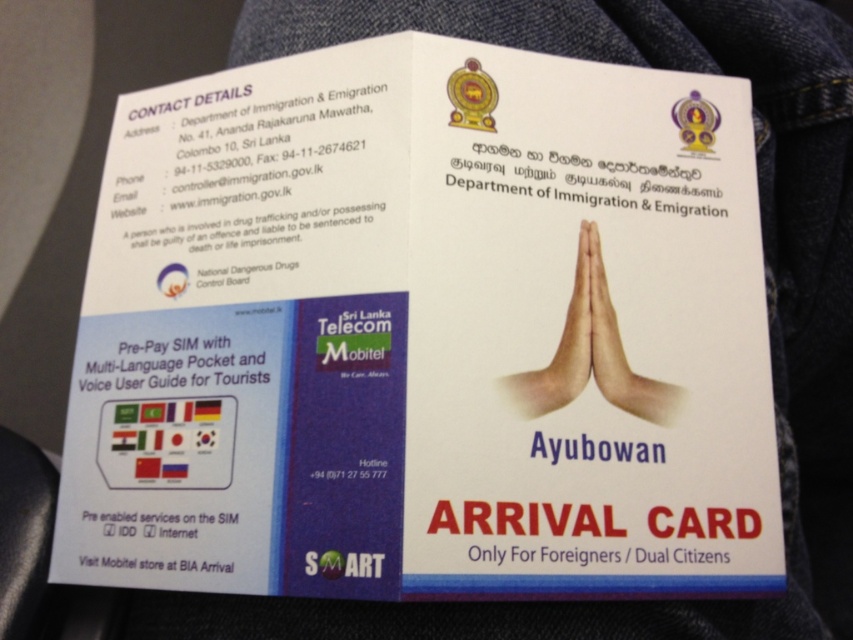
Question: In this image, where is faded denim jacket at lower right located relative to white matte hands at center?

Choices:
 (A) left
 (B) right

Answer: (B)

Question: Among these objects, which one is nearest to the camera?

Choices:
 (A) white matte hands at center
 (B) faded denim jacket at lower right

Answer: (B)

Question: Is faded denim jacket at lower right below white matte hands at center?

Choices:
 (A) yes
 (B) no

Answer: (A)

Question: Is faded denim jacket at lower right thinner than white matte hands at center?

Choices:
 (A) yes
 (B) no

Answer: (B)